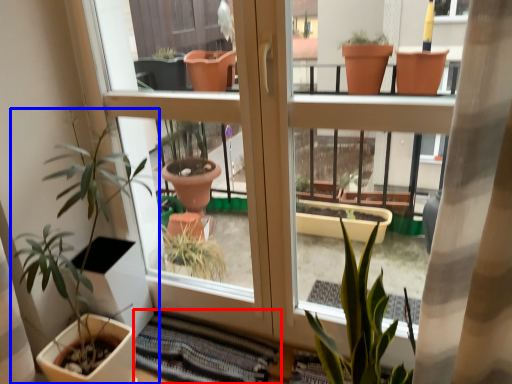
Question: Which point is further to the camera, atrium (highlighted by a red box) or houseplant (highlighted by a blue box)?

Choices:
 (A) atrium
 (B) houseplant

Answer: (A)